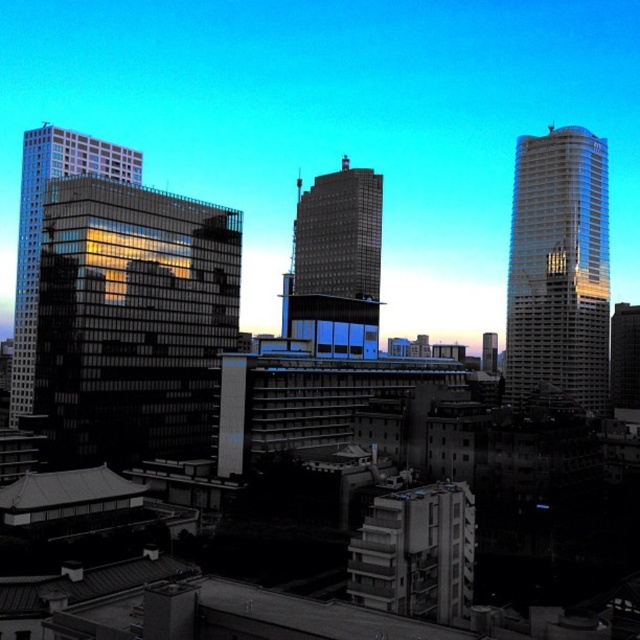
Does matte glass tower at center appear on the right side of reflective glass building at left?

Correct, you'll find matte glass tower at center to the right of reflective glass building at left.

Between point (364, 209) and point (36, 148), which one is positioned in front?

Point (36, 148) is more forward.

Find the location of a particular element. This screenshot has height=640, width=640. matte glass tower at center is located at coordinates (337, 262).

Between shiny glass skyscraper at right and matte glass tower at center, which one is positioned lower?

matte glass tower at center

Which is behind, point (528, 214) or point (368, 214)?

The point (368, 214) is more distant.

Where is `shiny glass skyscraper at right`? The width and height of the screenshot is (640, 640). shiny glass skyscraper at right is located at coordinates pos(557,268).

Between shiny glass skyscraper at right and reflective glass building at left, which one appears on the left side from the viewer's perspective?

reflective glass building at left

Is shiny glass skyscraper at right positioned behind reflective glass building at left?

Yes, shiny glass skyscraper at right is behind reflective glass building at left.

Locate an element on the screen. Image resolution: width=640 pixels, height=640 pixels. shiny glass skyscraper at right is located at coordinates (557, 268).